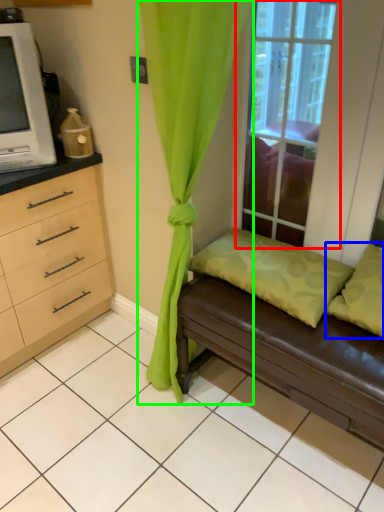
Question: Which object is the closest to the window (highlighted by a red box)? Choose among these: pillow (highlighted by a blue box) or curtain (highlighted by a green box).

Choices:
 (A) pillow
 (B) curtain

Answer: (A)